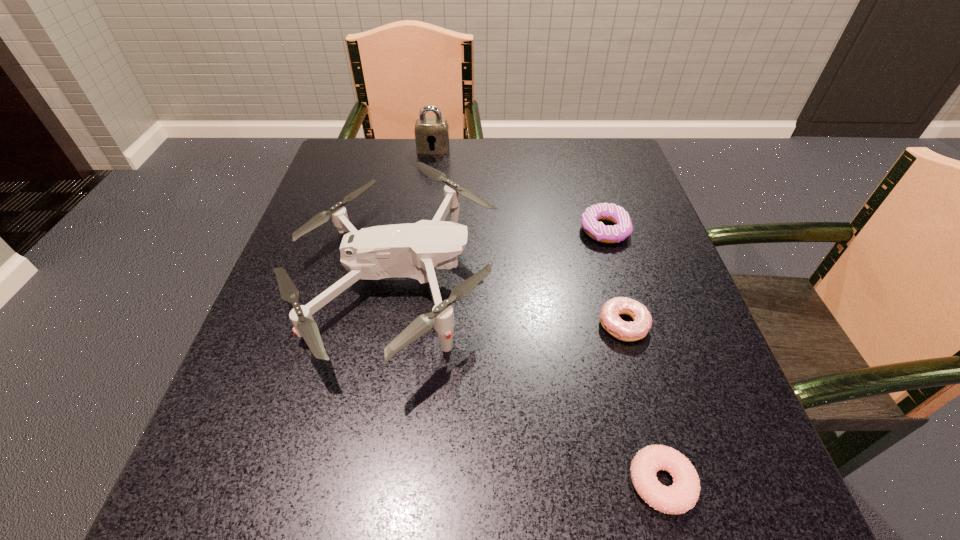
The image size is (960, 540). Identify the location of padlock. (431, 134).

Identify the location of drone. (413, 250).

This screenshot has height=540, width=960. Find the location of `the tallest doughnut`. the tallest doughnut is located at coordinates (596, 230).

Identify the location of the third shortest object. The image size is (960, 540). (596, 230).

The height and width of the screenshot is (540, 960). Find the location of `the second nearest doughnut`. the second nearest doughnut is located at coordinates (610, 320).

I want to click on the nearest doughnut, so click(682, 495).

Image resolution: width=960 pixels, height=540 pixels. I want to click on free spot located at the front of the farthest object near the keyhole, so click(419, 254).

Find the location of `vacant space located with a camera at the front of the drone`. vacant space located with a camera at the front of the drone is located at coordinates (604, 283).

Locate an element on the screen. The height and width of the screenshot is (540, 960). free spot located 0.220m on the back of the farthest doughnut is located at coordinates (584, 161).

This screenshot has width=960, height=540. I want to click on vacant area situated 0.250m on the front of the second farthest doughnut, so click(675, 509).